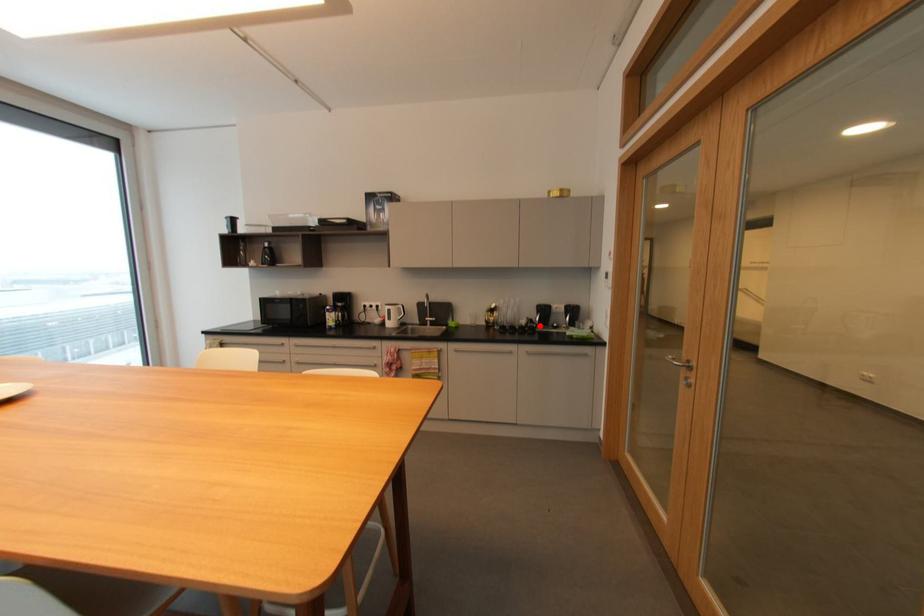
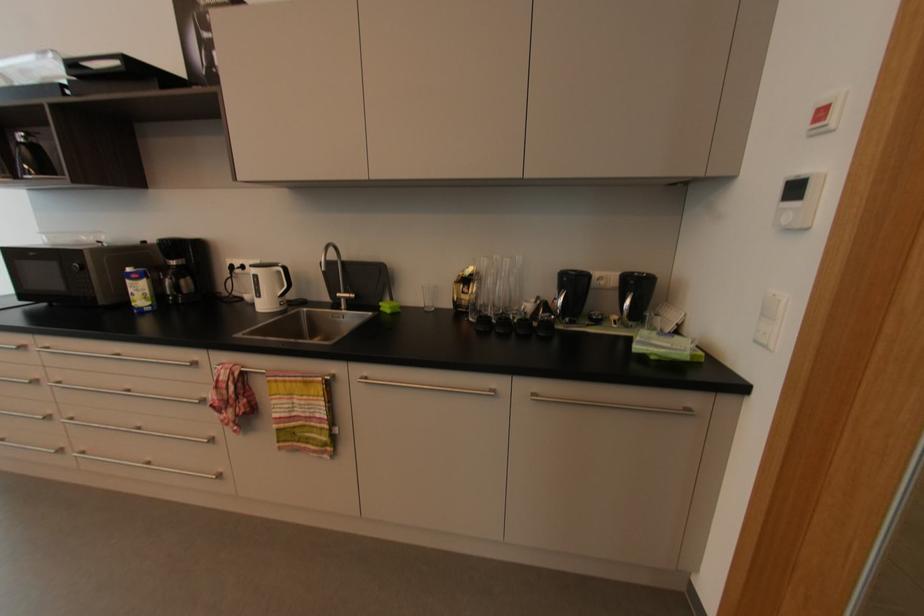
The point at the highlighted location is marked in the first image. Where is the corresponding point in the second image?

(561, 317)